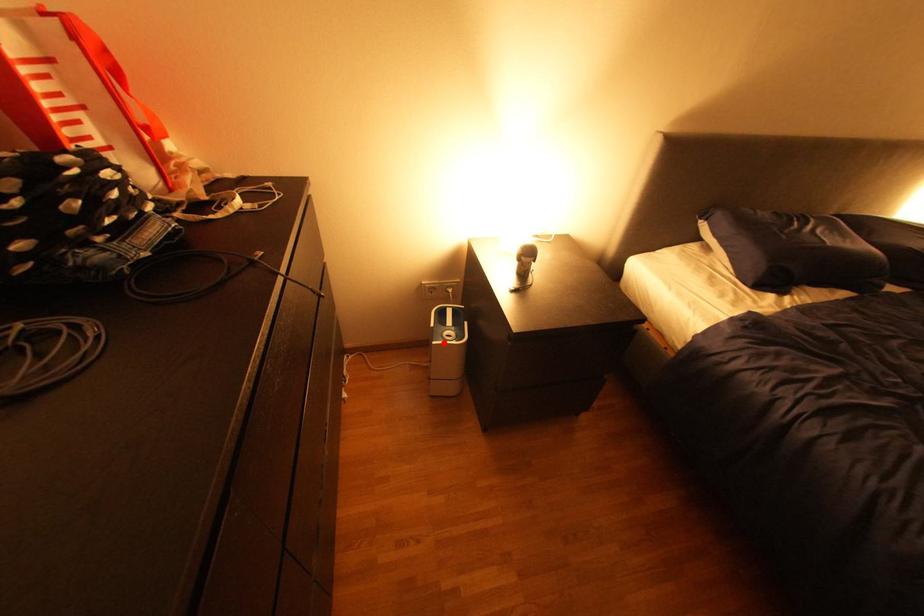
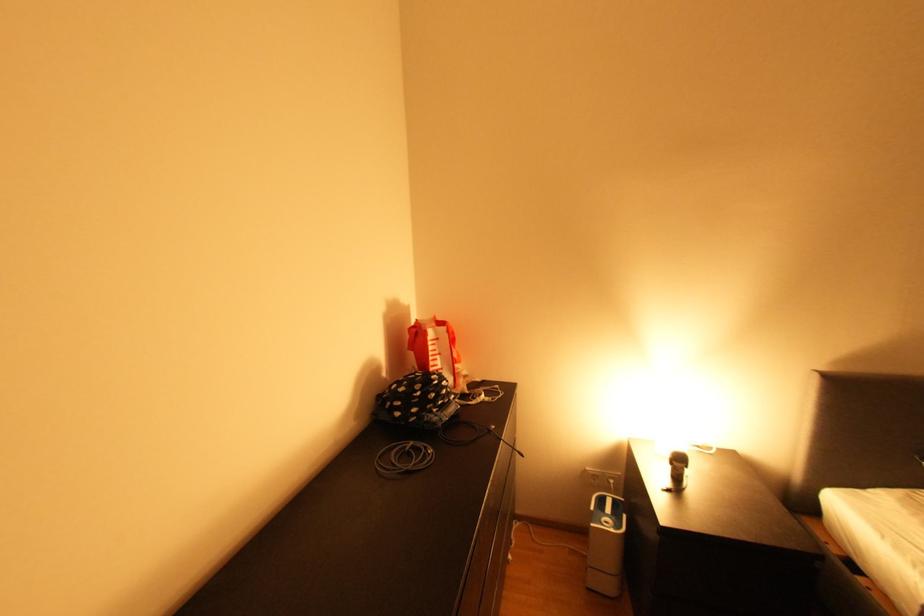
Question: I am providing you with two images of the same scene from different viewpoints. A red point is marked on the first image. Is the red point's position out of view in image 2?

Choices:
 (A) Yes
 (B) No

Answer: (B)